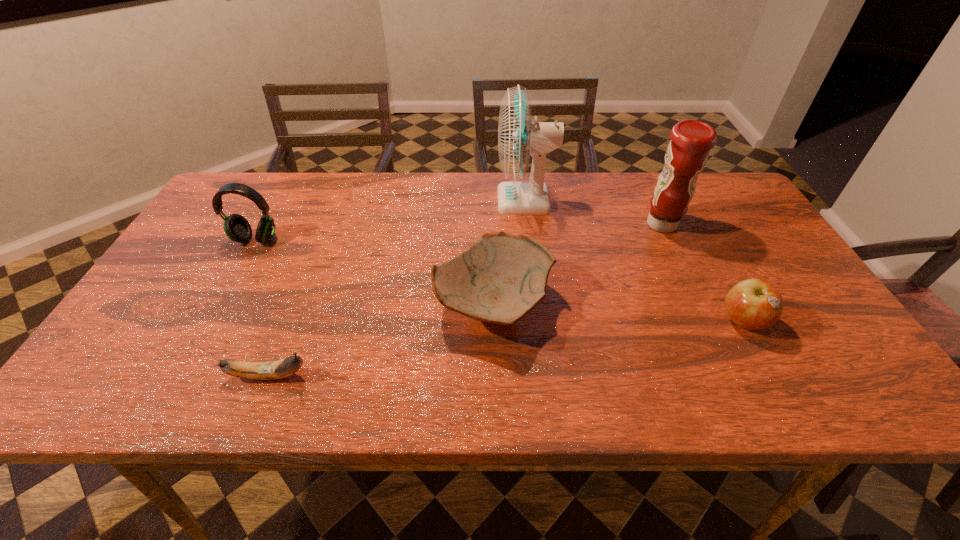
At what (x,y) coordinates should I click in order to perform the action: click on fan. Please return your answer as a coordinate pair (x, y). Looking at the image, I should click on (519, 135).

What are the coordinates of `the second tallest object` in the screenshot? It's located at (691, 140).

Identify the location of the third tallest object. This screenshot has width=960, height=540. (237, 228).

Identify the location of headset. (237, 228).

Where is `pottery`? The width and height of the screenshot is (960, 540). pottery is located at coordinates (501, 278).

What are the coordinates of `apple` in the screenshot? It's located at (755, 304).

Identify the location of the fifth object from right to left. (269, 370).

At what (x,y) coordinates should I click in order to perform the action: click on the nearest object. Please return your answer as a coordinate pair (x, y). Looking at the image, I should click on [x=269, y=370].

Find the location of a particular element. The width and height of the screenshot is (960, 540). free location located 0.190m in front of the fan to face the airflow is located at coordinates (434, 200).

Image resolution: width=960 pixels, height=540 pixels. I want to click on free space located in front of the fan to face the airflow, so click(x=480, y=200).